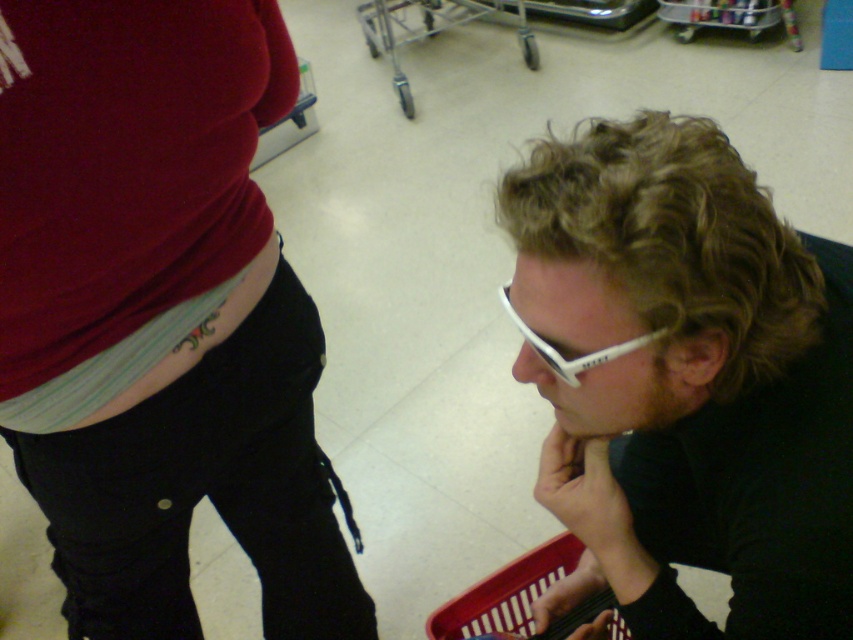
Question: Which point is farther to the camera?

Choices:
 (A) red plastic basket at lower right
 (B) white matte sunglasses at center
 (C) white fabric at left
 (D) metallic silver shopping cart at upper center

Answer: (D)

Question: Is white matte sunglasses at center smaller than white matte goggles at lower right?

Choices:
 (A) yes
 (B) no

Answer: (B)

Question: Among these objects, which one is nearest to the camera?

Choices:
 (A) white matte sunglasses at center
 (B) metallic silver shopping cart at upper center

Answer: (A)

Question: Is metallic silver shopping cart at upper center below white matte goggles at lower right?

Choices:
 (A) no
 (B) yes

Answer: (A)

Question: Among these objects, which one is farthest from the camera?

Choices:
 (A) white matte sunglasses at center
 (B) white matte goggles at lower right
 (C) white fabric at left

Answer: (C)

Question: Does white matte sunglasses at center appear on the right side of red plastic basket at lower right?

Choices:
 (A) no
 (B) yes

Answer: (B)